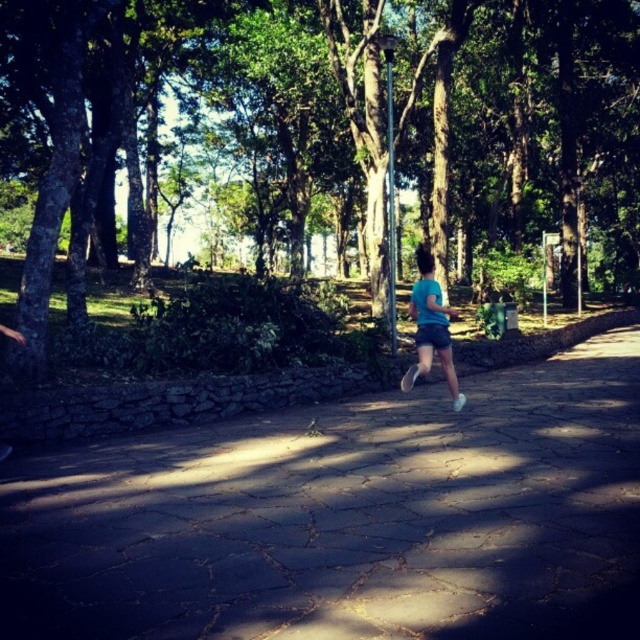
You are standing at the starting point of the pathway in the park and see two points marked on the ground ahead of you. The first point is at coordinates point (253, 61) and the second is at point (420, 262). If you want to reach the point that is closer to you, which one should you head towards?

You should head towards point (253, 61) because it is closer to you than point (420, 262).

You are standing at the entrance of the park and want to walk to the base of the green leafy tree at center. The paved stone path at center is the only path available. Considering their heights, can you walk directly to the tree without obstacles?

The paved stone path at center has a lesser height compared to green leafy tree at center, so yes, you can walk directly to the tree without obstacles since the path is lower and likely clear.